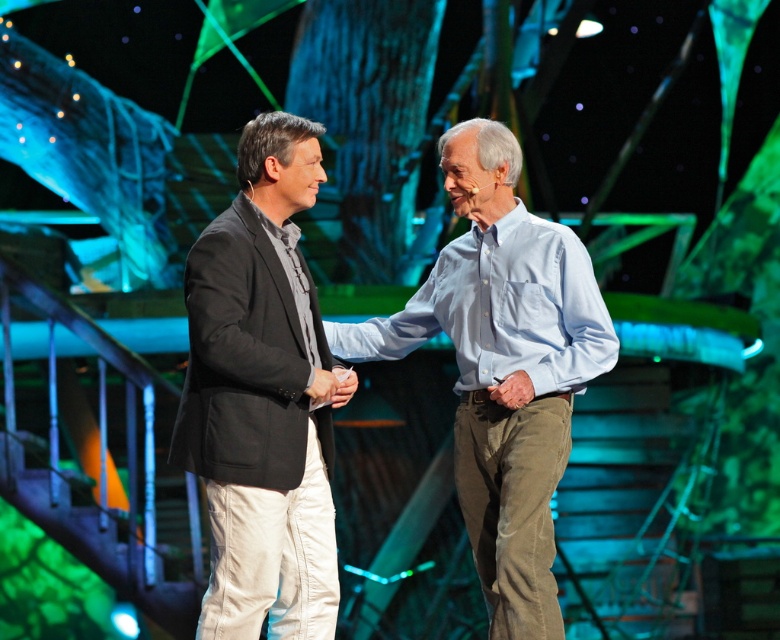
Question: Does matte black blazer at center appear over light blue cotton shirt at center?

Choices:
 (A) yes
 (B) no

Answer: (A)

Question: Among these objects, which one is farthest from the camera?

Choices:
 (A) matte black blazer at center
 (B) light blue cotton shirt at center

Answer: (B)

Question: Does matte black blazer at center have a smaller size compared to light blue cotton shirt at center?

Choices:
 (A) yes
 (B) no

Answer: (A)

Question: Among these points, which one is nearest to the camera?

Choices:
 (A) (452, 316)
 (B) (211, 502)

Answer: (B)

Question: Does matte black blazer at center have a greater width compared to light blue cotton shirt at center?

Choices:
 (A) yes
 (B) no

Answer: (B)